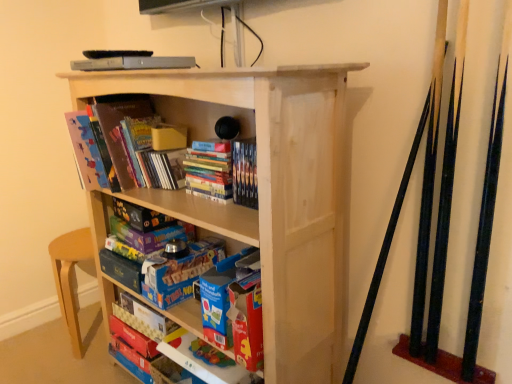
Question: From a real-world perspective, is matte cardboard book at left, which appears as the first book when viewed from the top, physically above natural wood bookcase at center?

Choices:
 (A) no
 (B) yes

Answer: (B)

Question: Does matte cardboard book at left, which appears as the third book when ordered from the bottom, have a larger size compared to natural wood bookcase at center?

Choices:
 (A) no
 (B) yes

Answer: (A)

Question: From a real-world perspective, is matte cardboard book at left, which appears as the first book when viewed from the top, under natural wood bookcase at center?

Choices:
 (A) no
 (B) yes

Answer: (A)

Question: From the image's perspective, is matte cardboard book at left, which appears as the third book when ordered from the bottom, under natural wood bookcase at center?

Choices:
 (A) no
 (B) yes

Answer: (A)

Question: Is matte cardboard book at left, which appears as the third book when ordered from the bottom, surrounding natural wood bookcase at center?

Choices:
 (A) no
 (B) yes

Answer: (A)

Question: Is matte cardboard book at left, which appears as the first book when viewed from the top, not close to natural wood bookcase at center?

Choices:
 (A) no
 (B) yes

Answer: (A)

Question: Is matte cardboard book at lower center, which is counted as the 1th book, starting from the bottom, placed right next to matte cardboard book at left, which appears as the third book when ordered from the bottom?

Choices:
 (A) yes
 (B) no

Answer: (B)

Question: From the image's perspective, would you say matte cardboard book at lower center, positioned as the third book in top-to-bottom order, is positioned over matte cardboard book at left, which appears as the first book when viewed from the top?

Choices:
 (A) no
 (B) yes

Answer: (A)

Question: Is matte cardboard book at lower center, which is counted as the 1th book, starting from the bottom, oriented away from matte cardboard book at left, which appears as the first book when viewed from the top?

Choices:
 (A) no
 (B) yes

Answer: (A)

Question: Is matte cardboard book at lower center, which is counted as the 1th book, starting from the bottom, taller than matte cardboard book at left, which appears as the first book when viewed from the top?

Choices:
 (A) no
 (B) yes

Answer: (A)

Question: From a real-world perspective, is matte cardboard book at lower center, which is counted as the 1th book, starting from the bottom, below matte cardboard book at left, which appears as the first book when viewed from the top?

Choices:
 (A) yes
 (B) no

Answer: (A)

Question: Can you confirm if matte cardboard book at lower center, which is counted as the 1th book, starting from the bottom, is wider than matte cardboard book at left, which appears as the first book when viewed from the top?

Choices:
 (A) yes
 (B) no

Answer: (B)

Question: Is natural wood bookcase at center taller than matte cardboard book at left, which appears as the first book when viewed from the top?

Choices:
 (A) no
 (B) yes

Answer: (B)